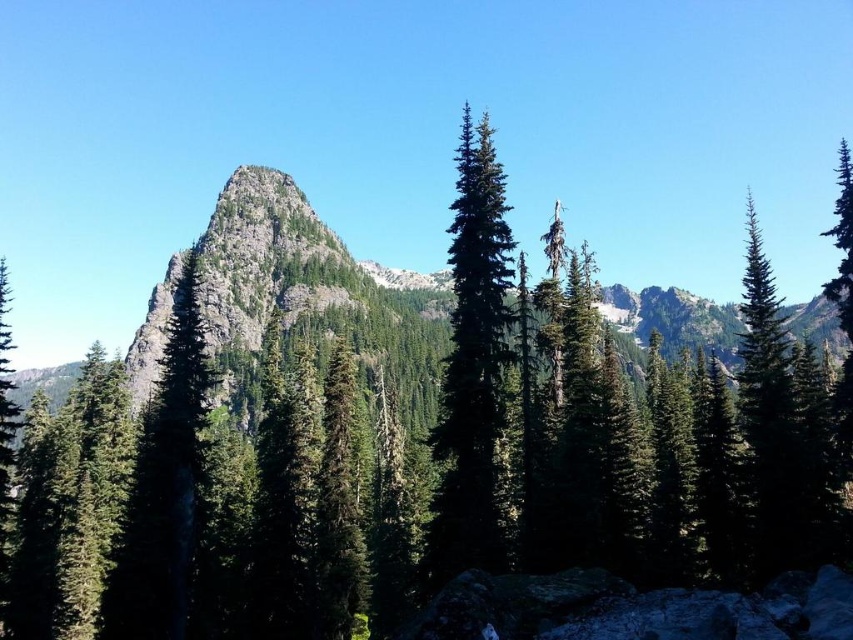
Where is `green matte tree at center`? The image size is (853, 640). green matte tree at center is located at coordinates (473, 369).

Does green matte tree at left have a larger size compared to green textured tree at right?

No, green matte tree at left is not bigger than green textured tree at right.

Which is more to the left, green matte tree at left or green textured tree at right?

green matte tree at left

Which is behind, point (163, 349) or point (849, 220)?

Point (849, 220)

Where is `green matte tree at left`? Image resolution: width=853 pixels, height=640 pixels. green matte tree at left is located at coordinates (164, 484).

Based on the photo, is green matte tree at center wider than green textured tree at right?

In fact, green matte tree at center might be narrower than green textured tree at right.

From the picture: Between green matte tree at center and green textured tree at right, which one is positioned higher?

green textured tree at right is above.

The width and height of the screenshot is (853, 640). What do you see at coordinates (473, 369) in the screenshot? I see `green matte tree at center` at bounding box center [473, 369].

Find the location of `green matte tree at center`. green matte tree at center is located at coordinates point(473,369).